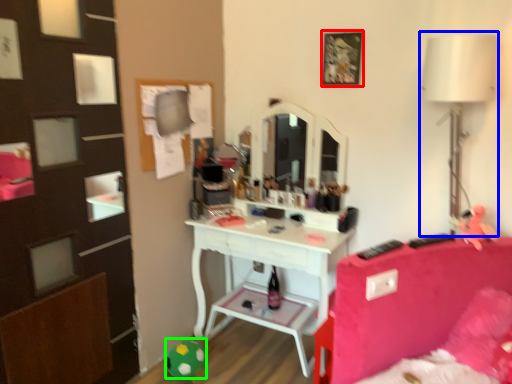
Question: Which is farther away from picture frame (highlighted by a red box)? table lamp (highlighted by a blue box) or toy (highlighted by a green box)?

Choices:
 (A) table lamp
 (B) toy

Answer: (B)